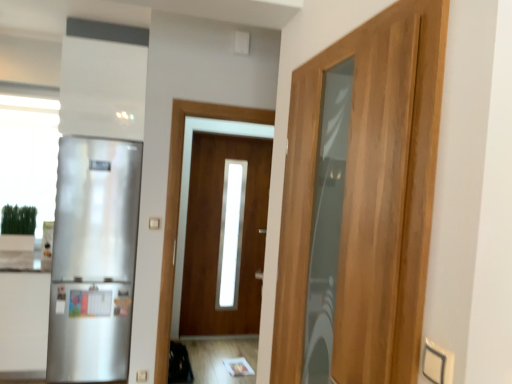
Find the location of `free space above wooden door at center, which is counted as the first door, starting from the back (from a real-world perspective)`. free space above wooden door at center, which is counted as the first door, starting from the back (from a real-world perspective) is located at coordinates (233, 142).